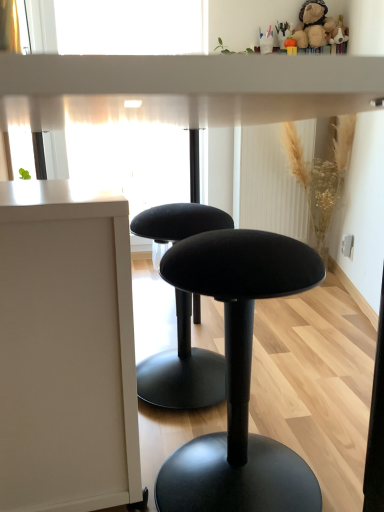
The image size is (384, 512). Describe the element at coordinates (239, 378) in the screenshot. I see `black matte stool at center` at that location.

This screenshot has height=512, width=384. I want to click on black matte stool at center, so click(239, 378).

This screenshot has width=384, height=512. I want to click on black matte stool at center, so click(x=239, y=378).